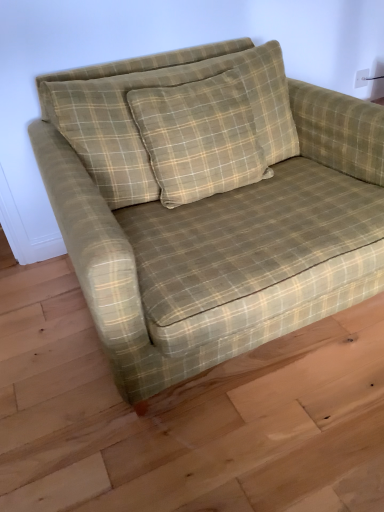
Question: From a real-world perspective, is white plastic electric outlet at upper right physically above green plaid pillow at center?

Choices:
 (A) yes
 (B) no

Answer: (B)

Question: Does white plastic electric outlet at upper right appear on the left side of green plaid pillow at center?

Choices:
 (A) no
 (B) yes

Answer: (A)

Question: Is white plastic electric outlet at upper right smaller than green plaid pillow at center?

Choices:
 (A) no
 (B) yes

Answer: (B)

Question: Does white plastic electric outlet at upper right have a lesser width compared to green plaid pillow at center?

Choices:
 (A) no
 (B) yes

Answer: (B)

Question: From the image's perspective, is white plastic electric outlet at upper right located beneath green plaid pillow at center?

Choices:
 (A) no
 (B) yes

Answer: (A)

Question: From a real-world perspective, does white plastic electric outlet at upper right sit lower than green plaid pillow at center?

Choices:
 (A) yes
 (B) no

Answer: (A)

Question: Can you confirm if green plaid pillow at center is wider than white plastic electric outlet at upper right?

Choices:
 (A) no
 (B) yes

Answer: (B)

Question: Is white plastic electric outlet at upper right located within green plaid pillow at center?

Choices:
 (A) yes
 (B) no

Answer: (B)

Question: Is green plaid pillow at center turned away from white plastic electric outlet at upper right?

Choices:
 (A) no
 (B) yes

Answer: (A)

Question: From a real-world perspective, is green plaid pillow at center located beneath white plastic electric outlet at upper right?

Choices:
 (A) no
 (B) yes

Answer: (A)

Question: From the image's perspective, would you say green plaid pillow at center is shown under white plastic electric outlet at upper right?

Choices:
 (A) yes
 (B) no

Answer: (A)

Question: Is green plaid pillow at center thinner than white plastic electric outlet at upper right?

Choices:
 (A) no
 (B) yes

Answer: (A)

Question: Does green plaid fabric couch at center appear on the left side of white plastic electric outlet at upper right?

Choices:
 (A) yes
 (B) no

Answer: (A)